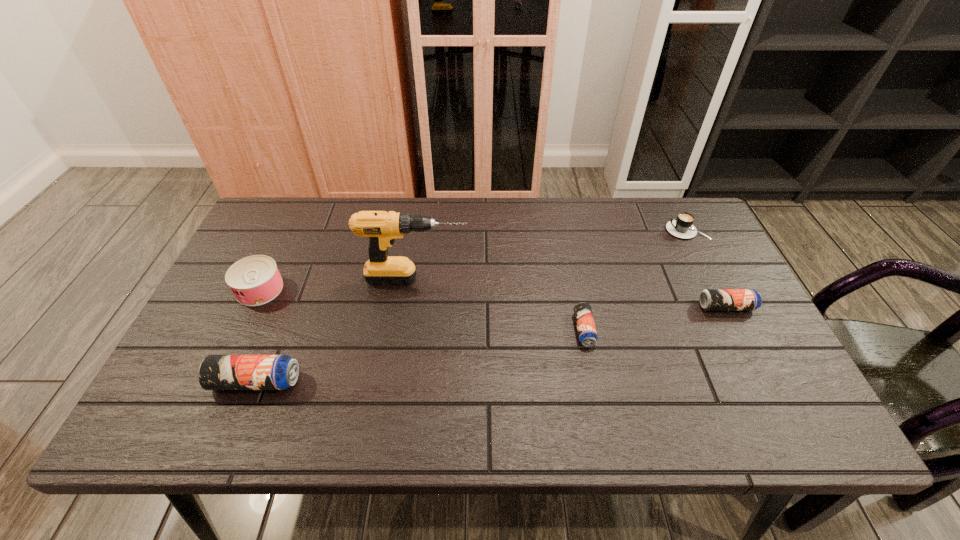
What are the coordinates of `vacant space at the far right corner of the desktop` in the screenshot? It's located at (674, 197).

This screenshot has width=960, height=540. What are the coordinates of `free space between the can and the rightmost beer can` in the screenshot? It's located at pos(493,298).

Where is `free space between the nearest object and the third object from right to left`? This screenshot has width=960, height=540. free space between the nearest object and the third object from right to left is located at coordinates (420, 355).

Find the location of a particular element. This screenshot has width=960, height=540. vacant area between the farthest object and the fourth object from right to left is located at coordinates (551, 254).

In order to click on vacant point located between the second shortest beer can and the farthest object in this screenshot , I will do `click(707, 268)`.

The image size is (960, 540). I want to click on vacant area that lies between the tallest beer can and the fourth object from right to left, so click(x=336, y=330).

You are a GUI agent. You are given a task and a screenshot of the screen. Output one action in this format:
    pyautogui.click(x=<x>, y=<y>)
    Task: Click on the vacant area that lies between the can and the fourth object from right to left
    This screenshot has height=540, width=960.
    Given the screenshot: What is the action you would take?
    pyautogui.click(x=338, y=284)

Identify the location of vacant point located between the third object from left to right and the second beer can from left to right. (500, 304).

Locate an element on the screen. The width and height of the screenshot is (960, 540). vacant area that lies between the rightmost beer can and the can is located at coordinates (493, 298).

The image size is (960, 540). I want to click on free spot between the leftmost beer can and the shortest object, so click(420, 355).